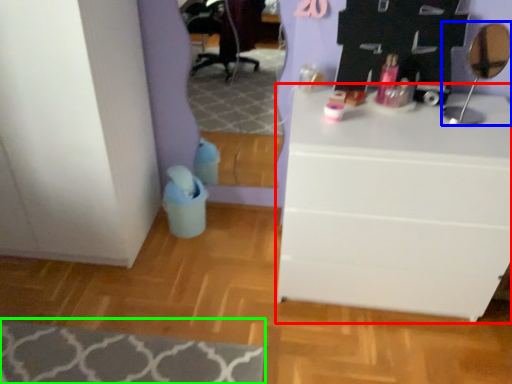
Question: Which object is the farthest from chest of drawers (highlighted by a red box)? Choose among these: mirror (highlighted by a blue box) or mat (highlighted by a green box).

Choices:
 (A) mirror
 (B) mat

Answer: (B)